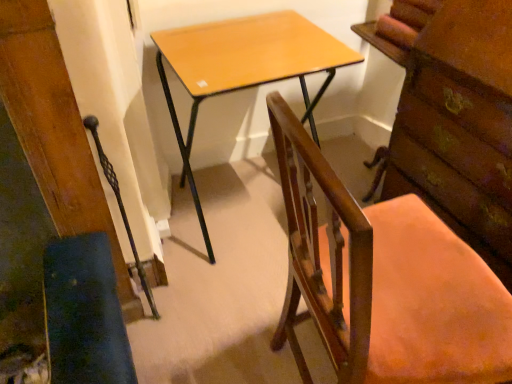
Locate an element on the screen. The width and height of the screenshot is (512, 384). vacant area on top of light brown wood desk at center (from a real-world perspective) is located at coordinates (245, 44).